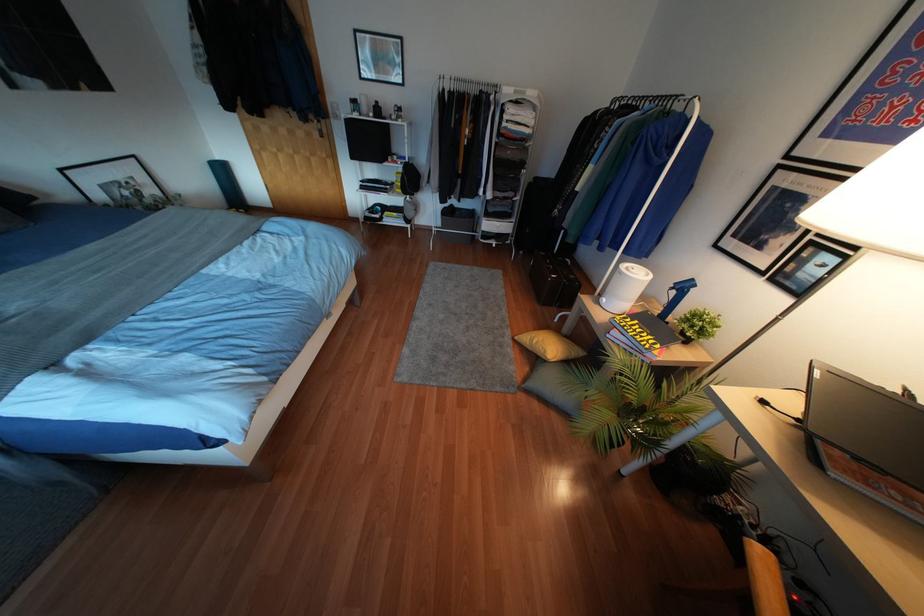
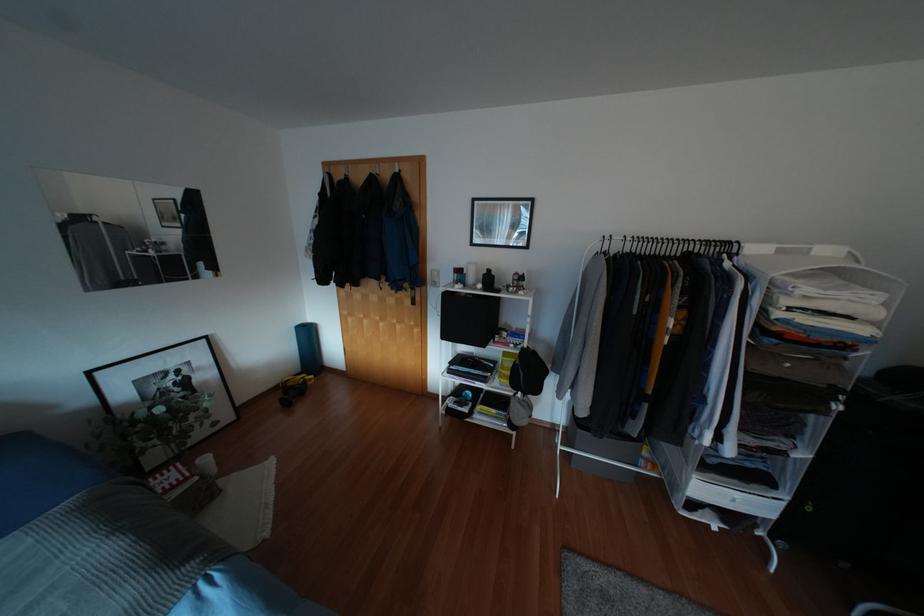
Locate, in the second image, the point that corresponds to (515,91) in the first image.

(779, 251)